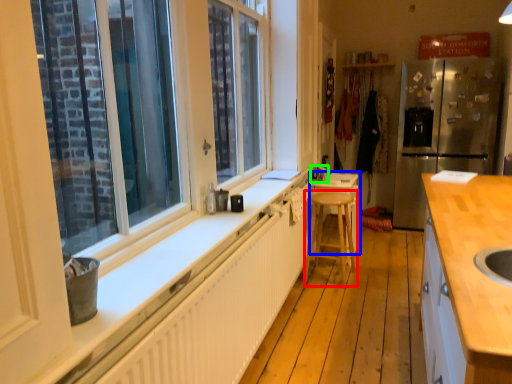
Question: Considering the real-world distances, which object is farthest from bar stool (highlighted by a red box)? table (highlighted by a blue box) or faucet (highlighted by a green box)?

Choices:
 (A) table
 (B) faucet

Answer: (B)